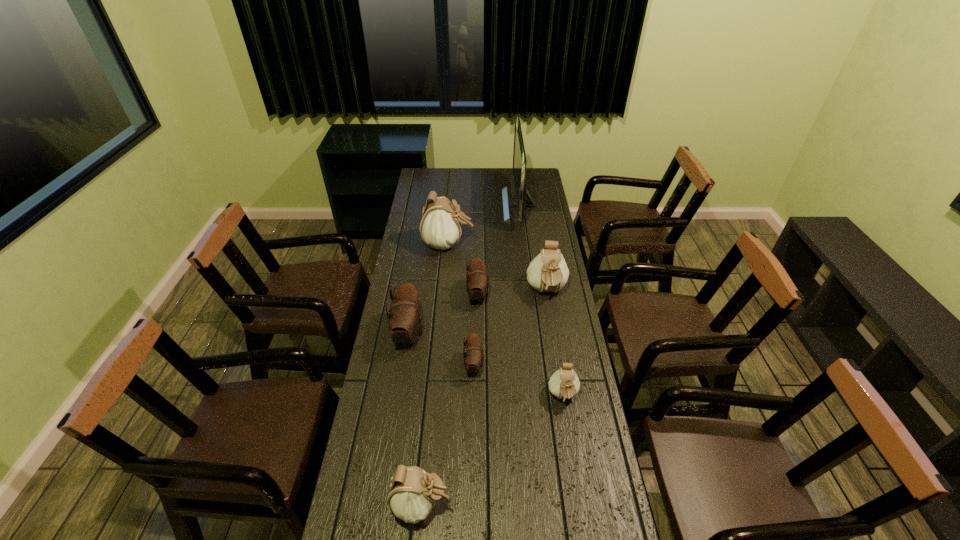
The width and height of the screenshot is (960, 540). Identify the location of vacant space situated 0.070m on the screen side of the tallest object. (490, 205).

Identify the location of vacant space located on the screen side of the tallest object. The image size is (960, 540). (452, 205).

Where is `vacant space situated on the screen side of the tallest object`? vacant space situated on the screen side of the tallest object is located at coordinates (476, 205).

The image size is (960, 540). Find the location of `vacant space located 0.240m on the front-facing side of the farthest white pouch`. vacant space located 0.240m on the front-facing side of the farthest white pouch is located at coordinates (525, 245).

Where is `vacant region located on the front-facing side of the third nearest white pouch`? This screenshot has width=960, height=540. vacant region located on the front-facing side of the third nearest white pouch is located at coordinates (562, 388).

The image size is (960, 540). Identify the location of free space located 0.090m with the flap open on the biggest brown pouch. (447, 334).

Where is `free space located on the front-facing side of the nearest object`? The image size is (960, 540). free space located on the front-facing side of the nearest object is located at coordinates (538, 504).

Where is `free spot located 0.100m with the flap open on the farthest brown pouch`? Image resolution: width=960 pixels, height=540 pixels. free spot located 0.100m with the flap open on the farthest brown pouch is located at coordinates (513, 295).

You are a GUI agent. You are given a task and a screenshot of the screen. Output one action in this format:
    pyautogui.click(x=<x>, y=<y>)
    Task: Click on the blank space located on the front-facing side of the smallest white pouch
    Image resolution: width=960 pixels, height=540 pixels.
    Given the screenshot: What is the action you would take?
    [x=577, y=485]

Where is `free region located with the flap open on the smallest brown pouch`? free region located with the flap open on the smallest brown pouch is located at coordinates (583, 366).